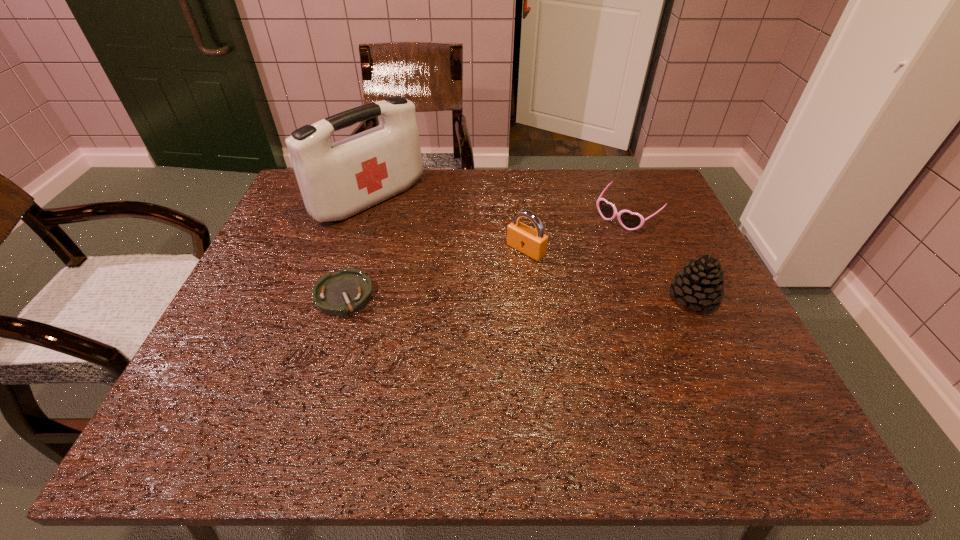
This screenshot has width=960, height=540. Find the location of `vacant space located 0.260m to unlock the padlock from the front`. vacant space located 0.260m to unlock the padlock from the front is located at coordinates (440, 318).

Locate an element on the screen. The width and height of the screenshot is (960, 540). free location located 0.330m to unlock the padlock from the front is located at coordinates (417, 336).

You are a GUI agent. You are given a task and a screenshot of the screen. Output one action in this format:
    pyautogui.click(x=<x>, y=<y>)
    Task: Click on the vacant space located to unlock the padlock from the front
    
    Given the screenshot: What is the action you would take?
    pyautogui.click(x=423, y=330)

You are a GUI agent. You are given a task and a screenshot of the screen. Output one action in this format:
    pyautogui.click(x=<x>, y=<y>)
    Task: Click on the vacant space situated 0.340m on the front side of the tallest object
    The width and height of the screenshot is (960, 540).
    Given the screenshot: What is the action you would take?
    pyautogui.click(x=487, y=284)

Identify the location of vacant area situated on the front side of the tallest object. The height and width of the screenshot is (540, 960). (448, 256).

The width and height of the screenshot is (960, 540). Find the location of `vacant space located on the front side of the tallest object`. vacant space located on the front side of the tallest object is located at coordinates (478, 278).

In order to click on free spot located 0.270m on the front-facing side of the sunglasses in this screenshot , I will do `click(551, 282)`.

Image resolution: width=960 pixels, height=540 pixels. Identify the location of free space located on the front-facing side of the sunglasses. (517, 312).

At what (x,y) coordinates should I click in order to perform the action: click on vacant space located 0.400m on the front-facing side of the sunglasses. Please return your answer as a coordinate pair (x, y). Image resolution: width=960 pixels, height=540 pixels. Looking at the image, I should click on (517, 312).

The width and height of the screenshot is (960, 540). I want to click on the first-aid kit that is positioned at the far edge, so click(337, 180).